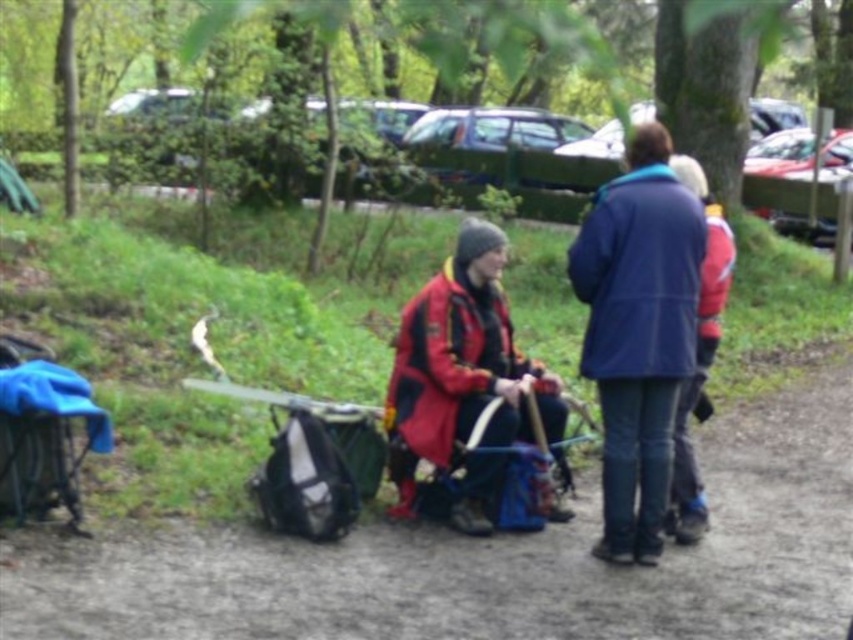
You are standing at the edge of the campsite and want to walk towards the blue fabric coat at upper right. Which direction should you move relative to the dirt ground at center?

You should move towards the blue fabric coat at upper right, which is behind the dirt ground at center, so you need to walk behind the dirt ground at center to reach it.

You are a hiker who wants to place a heavy backpack on the dirt ground at center. However, there is a red matte jacket at center already on it. Can you put the backpack there without moving the jacket?

The dirt ground at center is positioned under red matte jacket at center, meaning the jacket is already occupying that spot. Therefore, you cannot place the backpack there without moving the jacket.

You are a hiker planning to place a 60 cm wide map on the ground between the blue fabric coat at upper right and the red matte jacket at center. Can the map fit between them?

The blue fabric coat at upper right and red matte jacket at center are 71.18 centimeters apart from each other. Since the map is 60 cm wide, it can fit between them as the distance is sufficient.